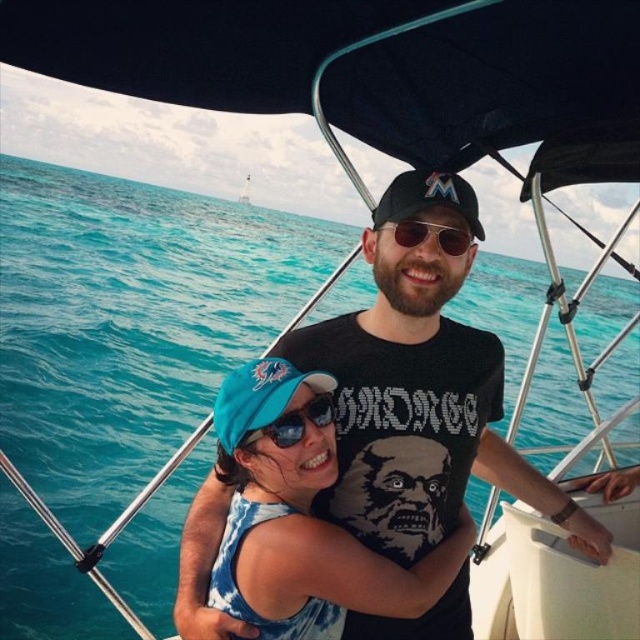
Question: Which point is closer to the camera?

Choices:
 (A) blue fabric cap at upper left
 (B) blue reflective sunglasses at center

Answer: (A)

Question: Which is farther from the sunglasses at center?

Choices:
 (A) blue fabric cap at upper left
 (B) blue reflective sunglasses at center

Answer: (A)

Question: Can you confirm if blue reflective sunglasses at center is thinner than sunglasses at center?

Choices:
 (A) yes
 (B) no

Answer: (A)

Question: Is blue fabric cap at upper left closer to the viewer compared to sunglasses at center?

Choices:
 (A) no
 (B) yes

Answer: (B)

Question: Which is farther from the sunglasses at center?

Choices:
 (A) blue fabric cap at upper left
 (B) blue reflective sunglasses at center

Answer: (A)

Question: Does blue fabric cap at upper left have a larger size compared to blue reflective sunglasses at center?

Choices:
 (A) no
 (B) yes

Answer: (B)